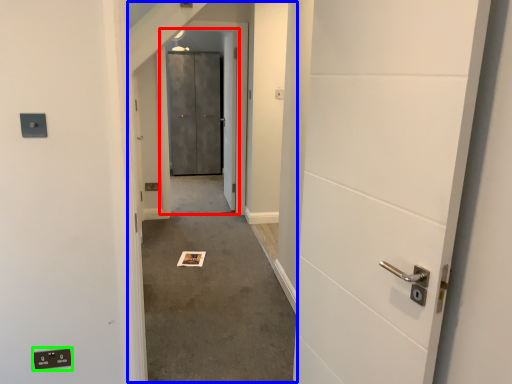
Question: Which is farther away from elevator door (highlighted by a red box)? corridor (highlighted by a blue box) or electric outlet (highlighted by a green box)?

Choices:
 (A) corridor
 (B) electric outlet

Answer: (B)